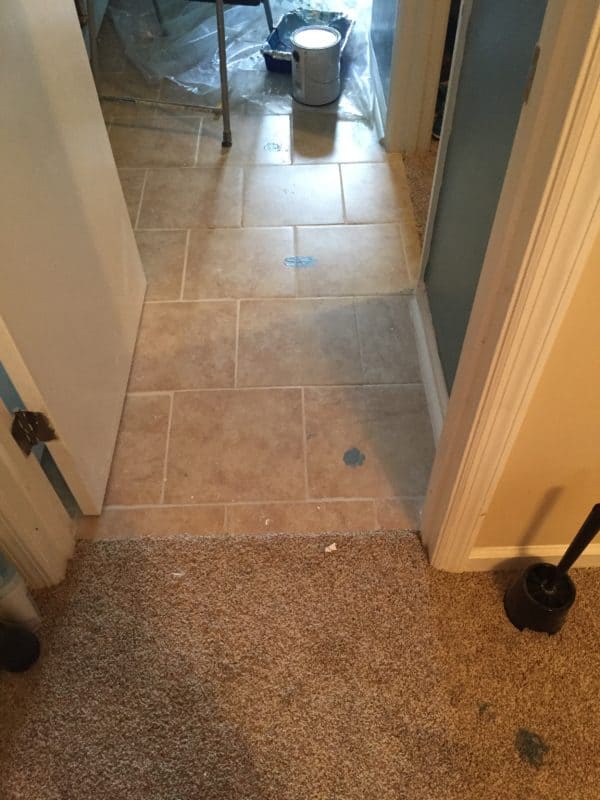
Locate an element on the screen. white moulding around door is located at coordinates (474, 496).